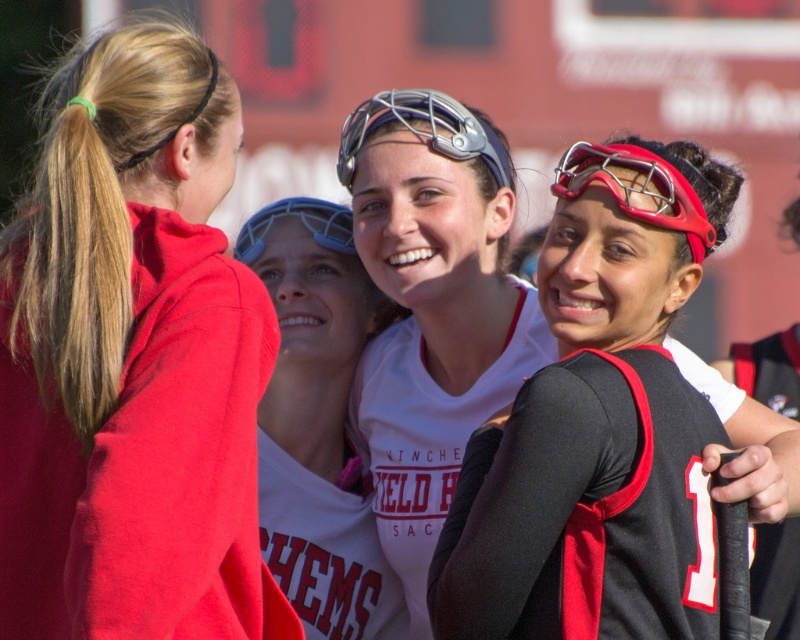
You are a photographer positioned at the back of the scene. You want to take a photo focusing on the white matte jersey at center and the matte blue plastic goggles at center. Which object will appear larger in your photo?

The white matte jersey at center will appear larger in the photo because it is closer to the viewer than the matte blue plastic goggles at center.

You are a photographer standing at the edge of the field. You want to take a closeup shot of the red matte metal goggles at upper right. Given that your camera has a maximum zoom range of 50 meters, can you capture a clear closeup of the goggles?

The red matte metal goggles at upper right is 55.51 meters away from viewer. Since the maximum zoom is 50 meters, the camera cannot reach that distance, so a clear closeup cannot be captured.